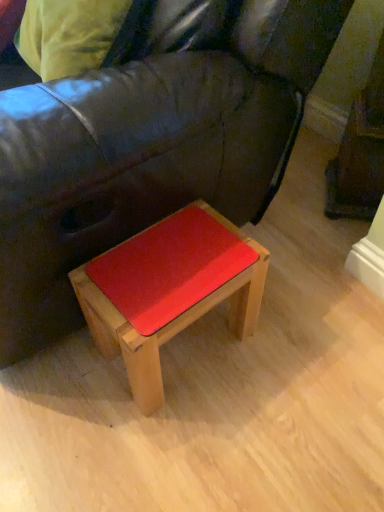
The height and width of the screenshot is (512, 384). I want to click on empty space that is ontop of wooden stool at lower center, so click(x=166, y=260).